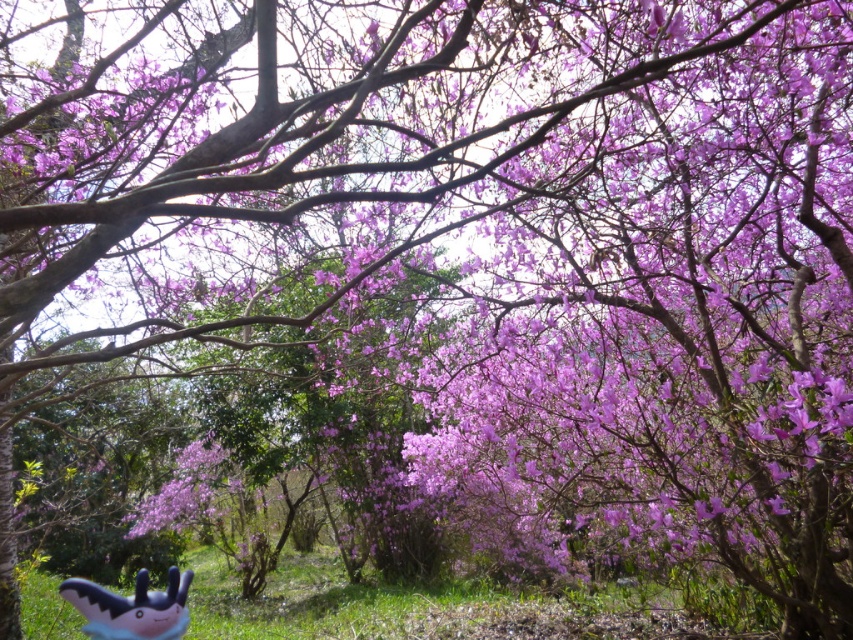
You are a gardener who wants to place a new plant between the matte purple flower at center and the plush toy at lower left. Which object should you use as a reference for height to ensure the new plant is proportionate?

The matte purple flower at center is much taller than the plush toy at lower left, so you should use the matte purple flower at center as a reference for height to ensure the new plant is proportionate.

You are planning to place a small statue exactly between the matte purple flower at center and the plush toy at lower left. Which object will the statue be closer to and why?

The statue will be closer to the plush toy at lower left because the distance between them is shorter than the distance between the statue and the matte purple flower at center due to the positioning of the objects.

You are a gardener who wants to place a new plant between the matte purple flower at center and the plush toy at lower left. Based on their positions, which object is closer to you so you can decide where to place the new plant?

The matte purple flower at center is closer to you than the plush toy at lower left, so you should place the new plant between them near the matte purple flower at center.